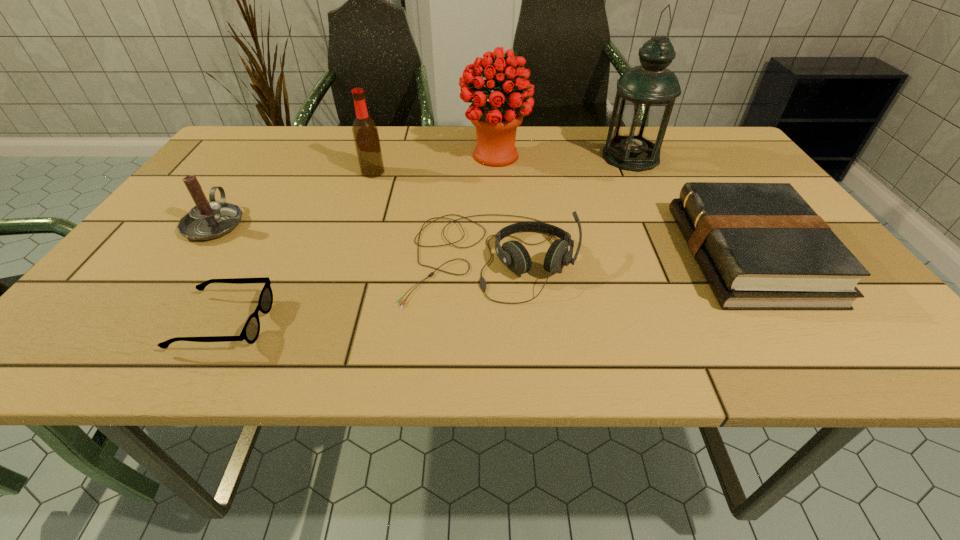
Where is `oil lamp`? This screenshot has height=540, width=960. oil lamp is located at coordinates [645, 96].

The height and width of the screenshot is (540, 960). Identify the location of the second tallest object. (496, 121).

This screenshot has height=540, width=960. I want to click on the third object from left to right, so click(x=366, y=137).

You are a GUI agent. You are given a task and a screenshot of the screen. Output one action in this format:
    pyautogui.click(x=<x>, y=<y>)
    Task: Click on the beer bottle
    This screenshot has width=960, height=540.
    Given the screenshot: What is the action you would take?
    pyautogui.click(x=366, y=137)

Locate an element on the screen. the leftmost object is located at coordinates (208, 219).

Find the location of a particular element. The height and width of the screenshot is (540, 960). candle is located at coordinates (208, 219).

The image size is (960, 540). What are the coordinates of `headset` in the screenshot? It's located at (513, 254).

Find the location of a particular element. This screenshot has width=960, height=540. hardback book is located at coordinates (760, 246).

You are a GUI agent. You are given a task and a screenshot of the screen. Output one action in this format:
    pyautogui.click(x=<x>, y=<y>)
    Task: Click on the shortest object
    The width and height of the screenshot is (960, 540).
    Given the screenshot: What is the action you would take?
    pyautogui.click(x=250, y=332)

Identify the location of spectacles. (250, 332).